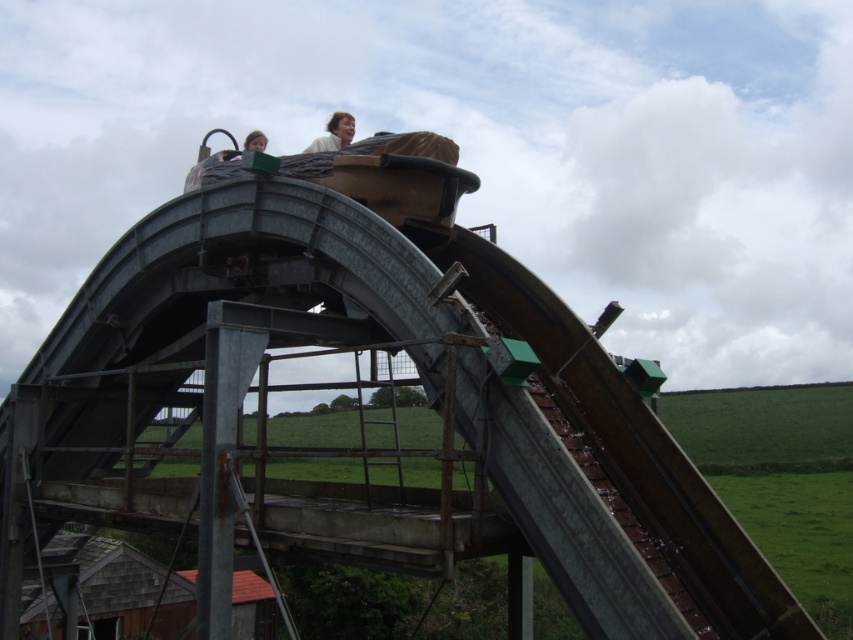
You are a maintenance worker standing at point (341,112). You need to reach the other worker who is 74.09 meters away. The structure is made of rusted metal and has a curved arch design. Can you safely walk across the structure to reach them?

The two workers are 74.09 meters apart. Since the structure is made of rusted metal and has a curved arch design, it might not be safe to walk across due to potential instability from rust and the challenging curvature of the path.

You are a safety inspector evaluating the industrial structure. You notice two items at the upper center of the image. Which item takes up more space, the light brown hair at upper center or the matte black helmet at upper center?

The matte black helmet at upper center takes up more space than the light brown hair at upper center.